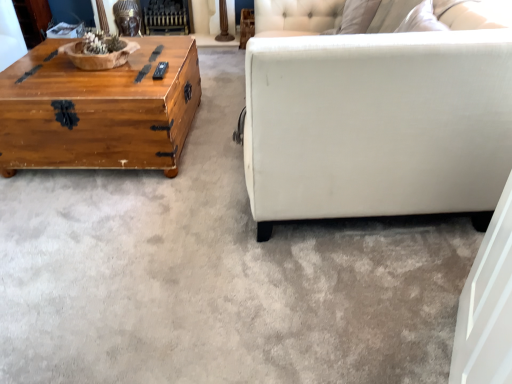
Question: Is wooden chest at left outside of black metal fireplace at upper center?

Choices:
 (A) no
 (B) yes

Answer: (B)

Question: Is wooden chest at left not close to black metal fireplace at upper center?

Choices:
 (A) no
 (B) yes

Answer: (B)

Question: Is wooden chest at left aimed at black metal fireplace at upper center?

Choices:
 (A) yes
 (B) no

Answer: (B)

Question: From the image's perspective, is wooden chest at left above black metal fireplace at upper center?

Choices:
 (A) yes
 (B) no

Answer: (B)

Question: Is wooden chest at left smaller than black metal fireplace at upper center?

Choices:
 (A) yes
 (B) no

Answer: (B)

Question: From the image's perspective, is wooden chest at left located beneath black metal fireplace at upper center?

Choices:
 (A) yes
 (B) no

Answer: (A)

Question: Could you tell me if black metal fireplace at upper center is facing wooden chest at left?

Choices:
 (A) yes
 (B) no

Answer: (A)

Question: From a real-world perspective, is black metal fireplace at upper center on wooden chest at left?

Choices:
 (A) no
 (B) yes

Answer: (A)

Question: Is there a large distance between black metal fireplace at upper center and wooden chest at left?

Choices:
 (A) no
 (B) yes

Answer: (B)

Question: From the image's perspective, does black metal fireplace at upper center appear higher than wooden chest at left?

Choices:
 (A) yes
 (B) no

Answer: (A)

Question: Does black metal fireplace at upper center appear on the left side of wooden chest at left?

Choices:
 (A) no
 (B) yes

Answer: (A)

Question: Considering the relative sizes of black metal fireplace at upper center and wooden chest at left in the image provided, is black metal fireplace at upper center taller than wooden chest at left?

Choices:
 (A) yes
 (B) no

Answer: (B)

Question: Would you say black metal fireplace at upper center is to the left or to the right of wooden chest at left in the picture?

Choices:
 (A) right
 (B) left

Answer: (A)